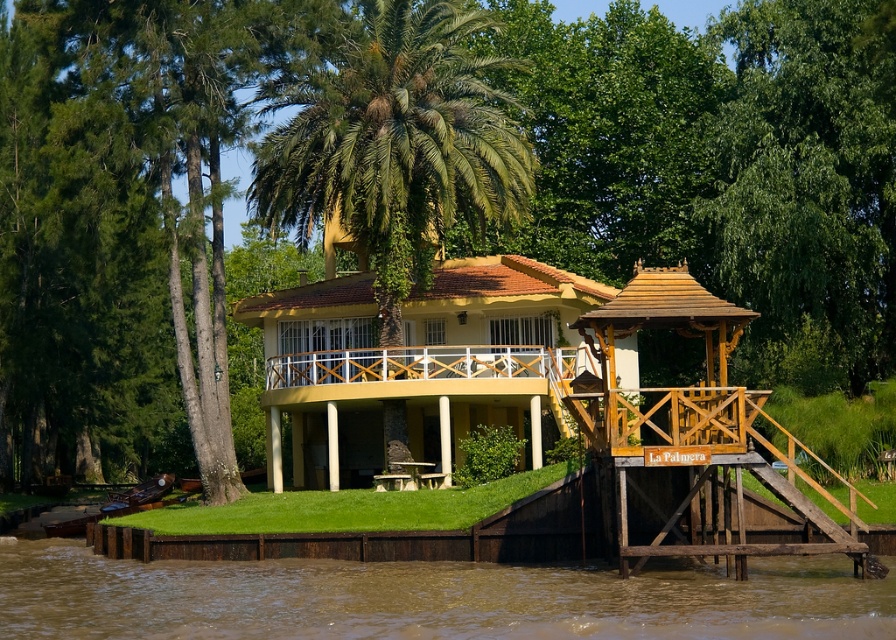
Between brown muddy water at lower left and wooden gazebo at right, which one has less height?

With less height is brown muddy water at lower left.

Who is more distant from viewer, [639,609] or [583,428]?

Positioned behind is point [583,428].

This screenshot has width=896, height=640. I want to click on brown muddy water at lower left, so click(428, 598).

How much distance is there between green leafy palm tree at center and white wood railing at center?

18.24 feet

I want to click on green leafy palm tree at center, so click(395, 145).

In order to click on green leafy palm tree at center in this screenshot , I will do `click(395, 145)`.

Between brown muddy water at lower left and green leafy palm tree at center, which one appears on the left side from the viewer's perspective?

brown muddy water at lower left is more to the left.

Based on the photo, between brown muddy water at lower left and green leafy palm tree at center, which one appears on the right side from the viewer's perspective?

Positioned to the right is green leafy palm tree at center.

Is point (160, 604) closer to viewer compared to point (366, 198)?

Yes, point (160, 604) is closer to viewer.

Identify the location of brown muddy water at lower left. The height and width of the screenshot is (640, 896). (428, 598).